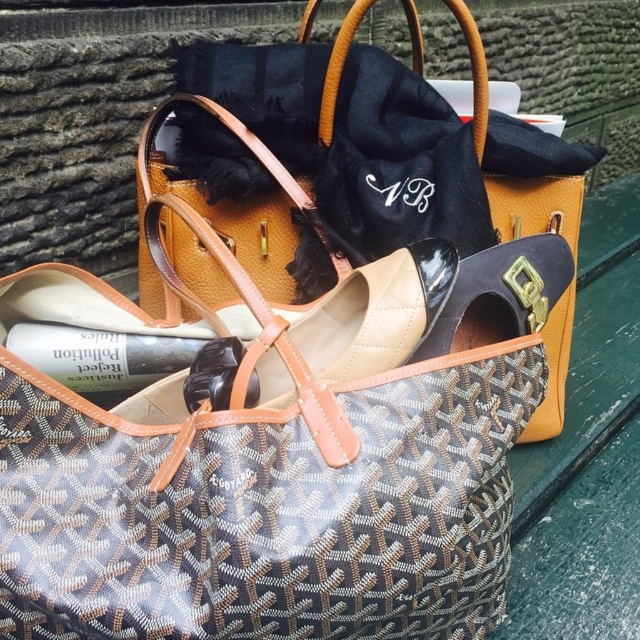
You are standing at the camera position and want to pick up the object located at point (500, 577). Can you reach it without moving your feet?

The point (500, 577) is 35.48 inches away from the camera. Since the average human arm length is about 25 inches, you cannot reach it without moving your feet.

You are organizing items on a table and see the brown textured bag at center and the beige patent leather shoe at center. Which item is positioned to the right side?

The brown textured bag at center is to the right of the beige patent leather shoe at center.

In the scene shown: You are a delivery person who needs to place a package on the green wooden surface. The package is 10 cm thick. There is a brown textured bag at center and a beige patent leather shoe at center on the surface. Can the package fit between them?

The brown textured bag at center is further to the viewer than beige patent leather shoe at center, so the distance between them is not specified. Therefore, it is impossible to determine if the package will fit without knowing the exact spacing between the two items.